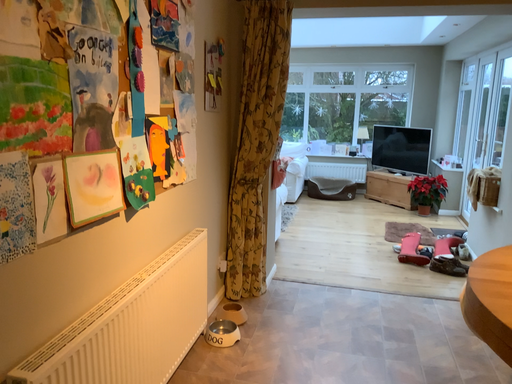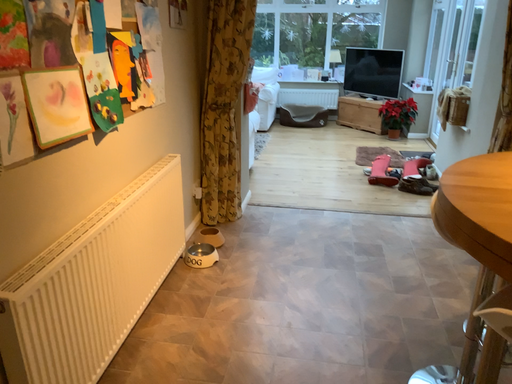
Question: How did the camera likely rotate when shooting the video?

Choices:
 (A) rotated downward
 (B) rotated upward

Answer: (A)